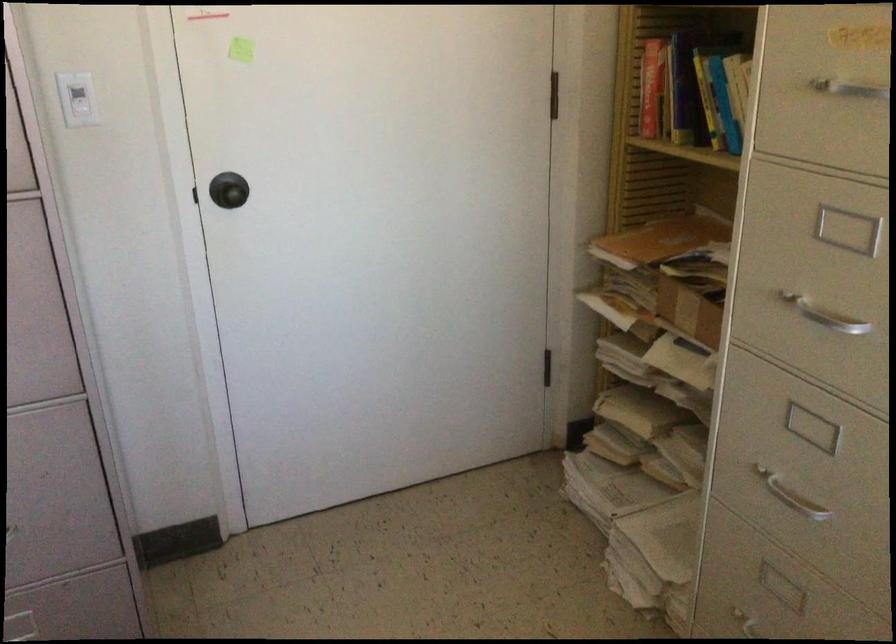
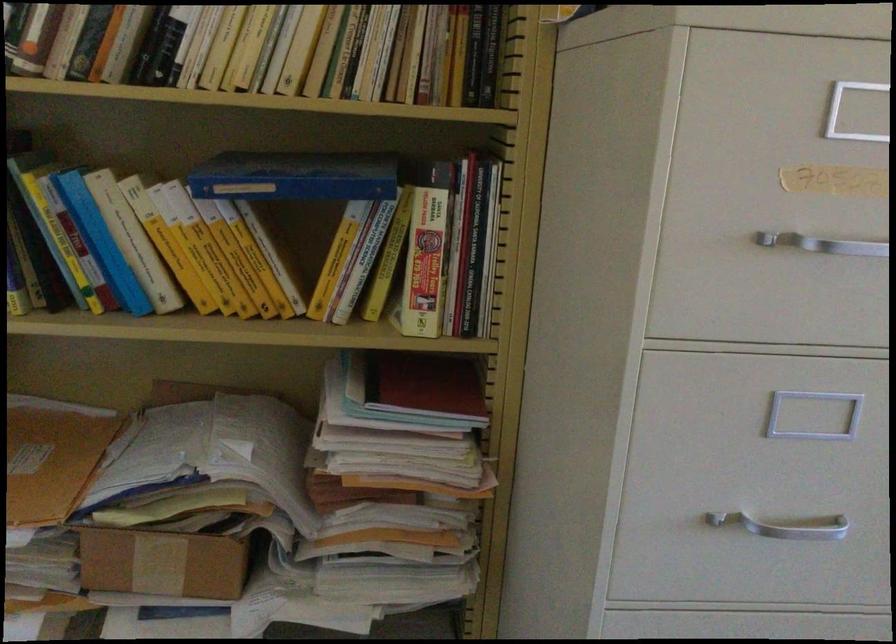
Where in the second image is the point corresponding to the point at 677,307 from the first image?

(161, 564)